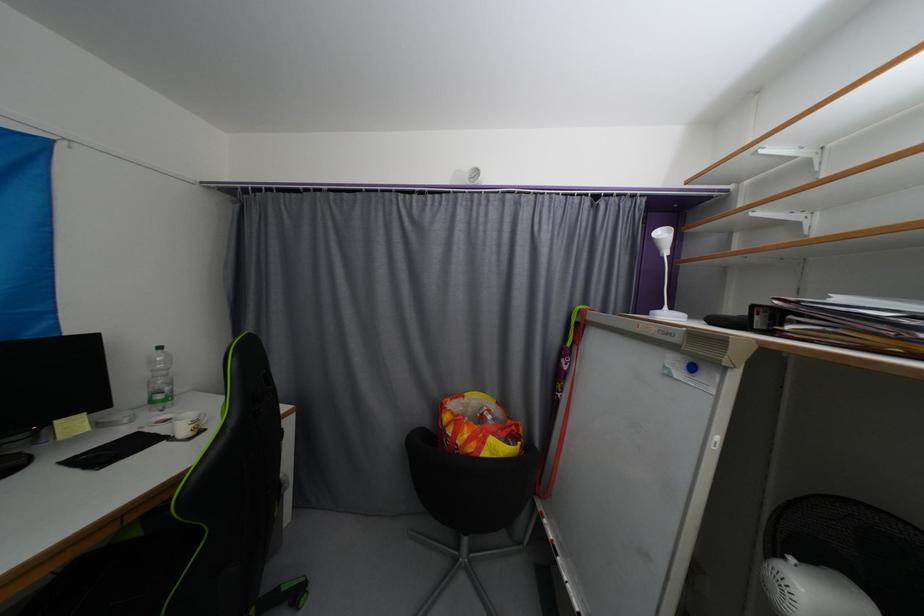
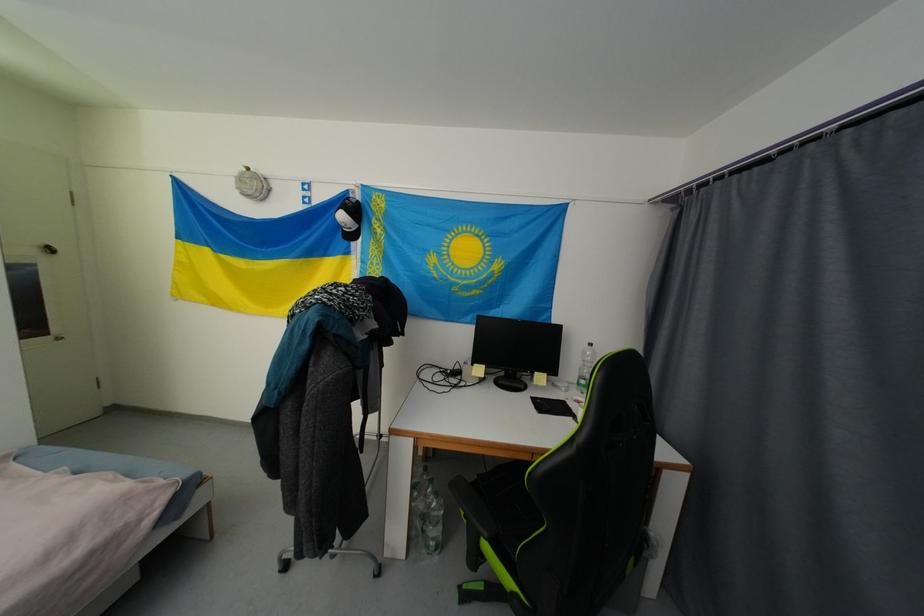
Locate, in the second image, the point that corresponds to point (79, 427) in the first image.

(545, 379)